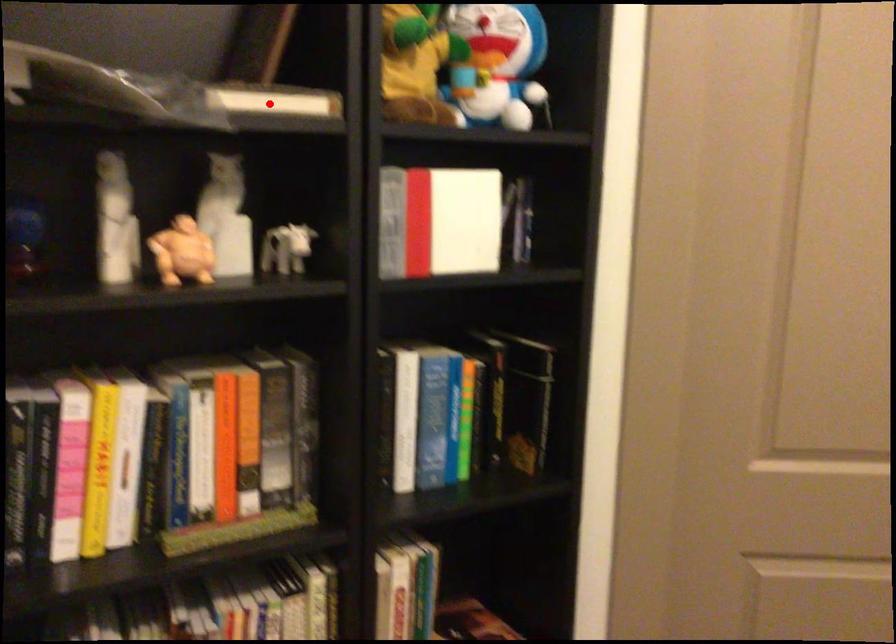
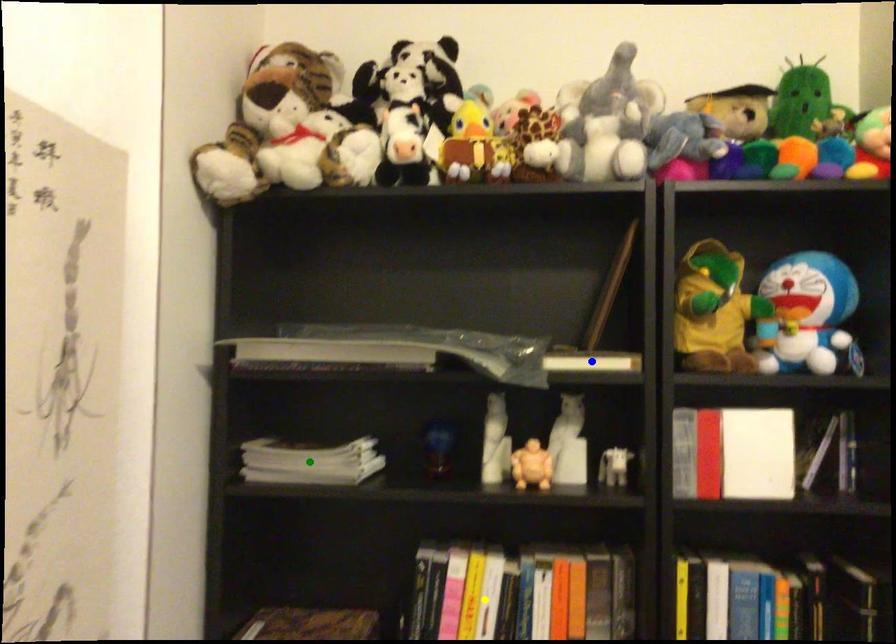
Question: I am providing you with two images of the same scene from different viewpoints. A red point is marked on the first image. You are given multiple points on the second image. Which point in image 2 represents the same 3d spot as the red point in image 1?

Choices:
 (A) yellow point
 (B) blue point
 (C) green point

Answer: (B)